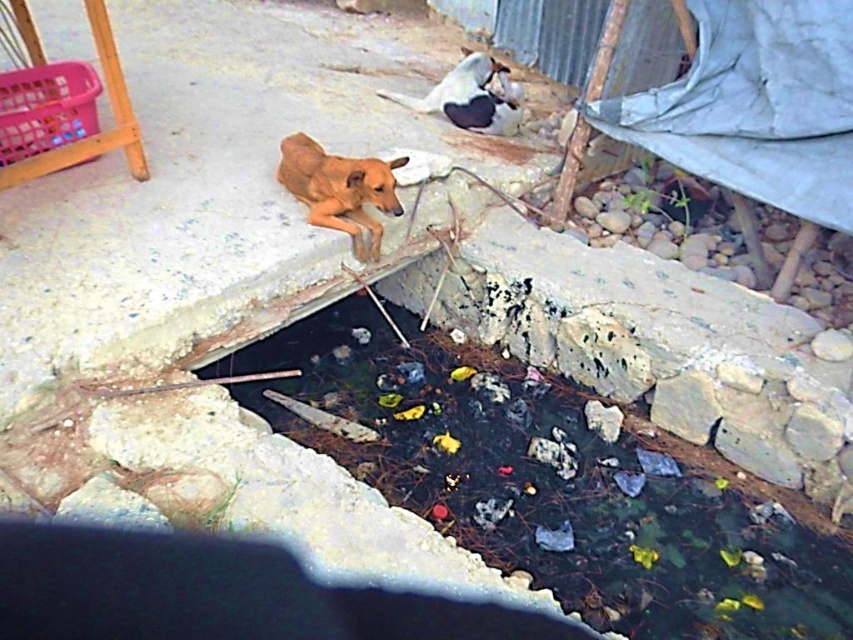
Question: Is black stone puddle at center to the left of white fur dog at upper center from the viewer's perspective?

Choices:
 (A) no
 (B) yes

Answer: (A)

Question: Among these objects, which one is nearest to the camera?

Choices:
 (A) brown furry dog at center
 (B) white fur dog at upper center
 (C) black stone puddle at center

Answer: (C)

Question: Which object is closer to the camera taking this photo?

Choices:
 (A) black stone puddle at center
 (B) white fur dog at upper center

Answer: (A)

Question: Does black stone puddle at center have a greater width compared to brown furry dog at center?

Choices:
 (A) yes
 (B) no

Answer: (A)

Question: Which object is farther from the camera taking this photo?

Choices:
 (A) brown furry dog at center
 (B) black stone puddle at center
 (C) white fur dog at upper center

Answer: (C)

Question: Is black stone puddle at center to the left of white fur dog at upper center from the viewer's perspective?

Choices:
 (A) no
 (B) yes

Answer: (A)